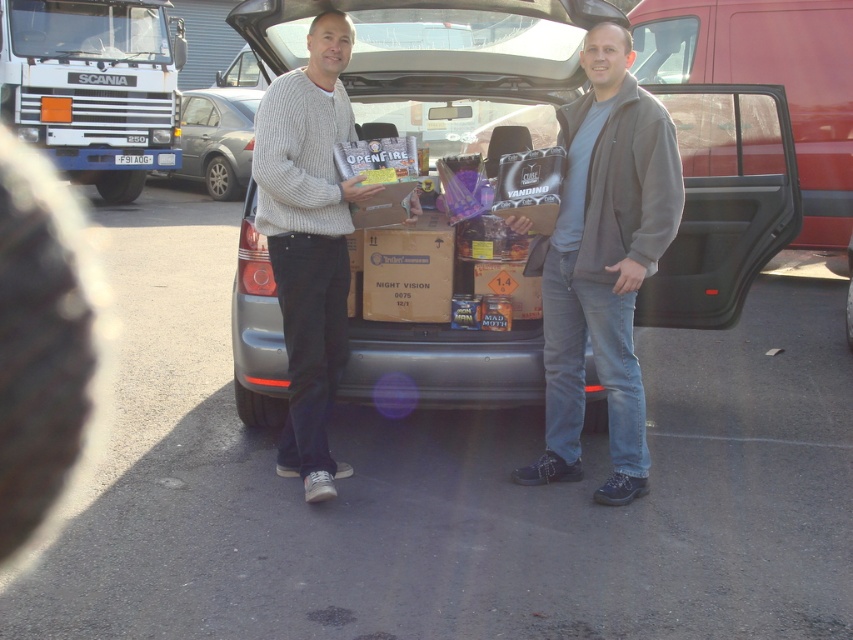
Can you confirm if metallic red pickup truck at right is taller than brown cardboard box at center?

Correct, metallic red pickup truck at right is much taller as brown cardboard box at center.

Consider the image. Between metallic red pickup truck at right and brown cardboard box at center, which one appears on the left side from the viewer's perspective?

brown cardboard box at center

Which is in front, point (776, 36) or point (392, 228)?

Point (392, 228) is in front.

Where is `metallic red pickup truck at right`? This screenshot has width=853, height=640. metallic red pickup truck at right is located at coordinates (769, 81).

Who is more distant from viewer, (x=753, y=179) or (x=0, y=99)?

The point (x=0, y=99) is behind.

Based on the photo, does metallic gray car at center have a smaller size compared to white plastic truck at upper left?

No, metallic gray car at center is not smaller than white plastic truck at upper left.

In the scene shown: Who is more distant from viewer, (482,16) or (32,88)?

The point (32,88) is behind.

This screenshot has height=640, width=853. I want to click on metallic gray car at center, so click(x=445, y=65).

Does metallic gray car at center have a larger size compared to brown cardboard box at center?

Correct, metallic gray car at center is larger in size than brown cardboard box at center.

Does point (428, 36) come closer to viewer compared to point (438, 237)?

No.

Measure the distance between metallic gray car at center and camera.

metallic gray car at center and camera are 15.00 feet apart.

The image size is (853, 640). Find the location of `metallic gray car at center`. metallic gray car at center is located at coordinates (445, 65).